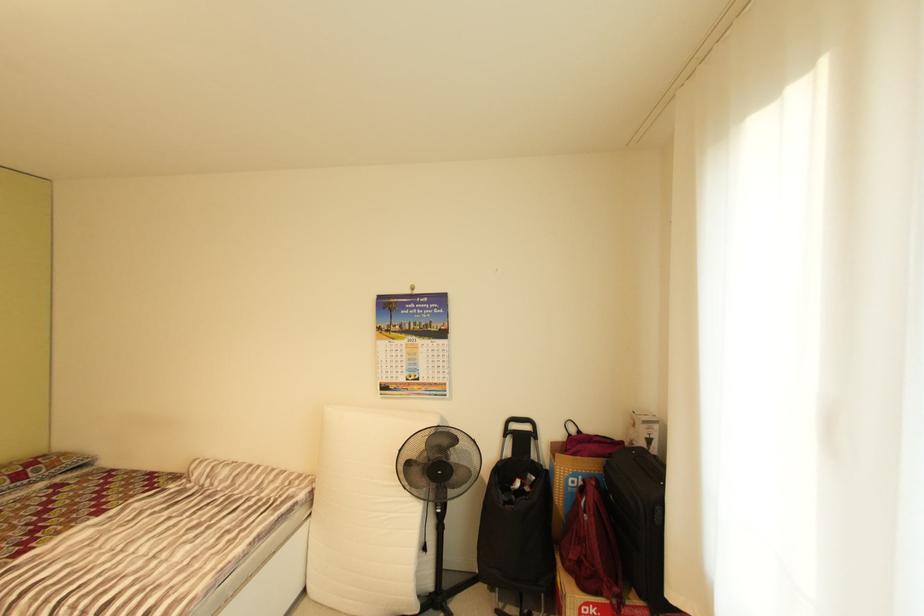
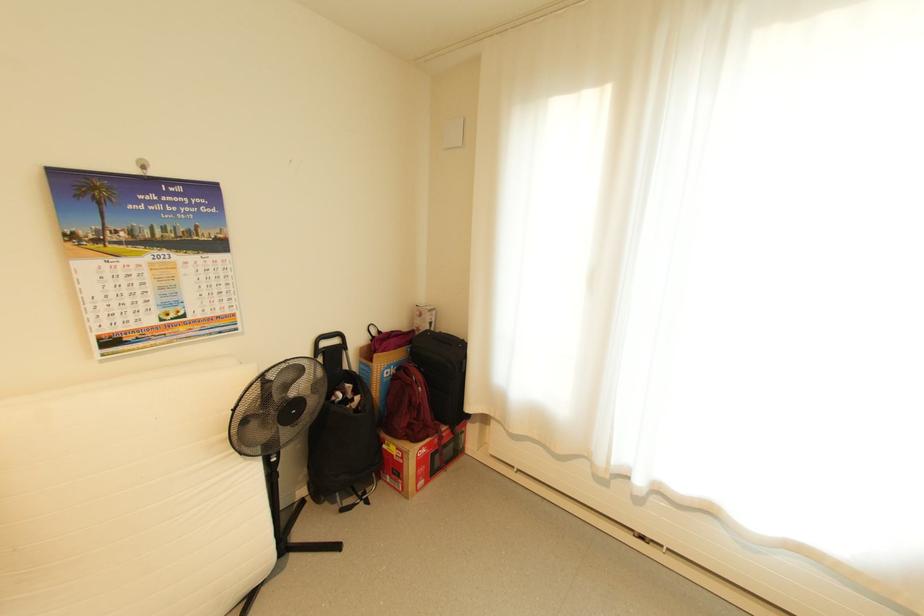
Question: I am providing you with two images of the same scene from different viewpoints. Which of the following objects are not visible in image2?

Choices:
 (A) black suitcase handle
 (B) luggage cart handle
 (C) red cardboard box
 (D) none of these

Answer: (D)